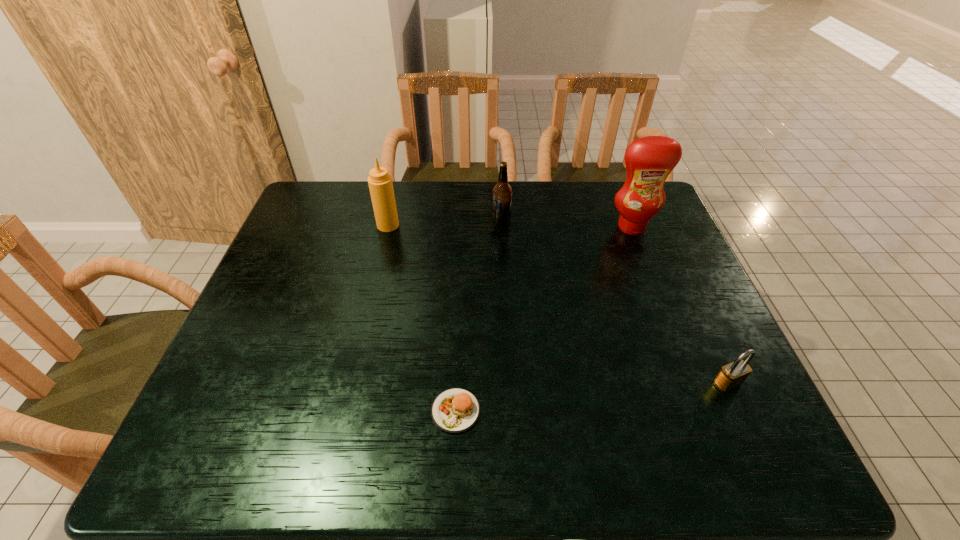
The height and width of the screenshot is (540, 960). What are the coordinates of `vacant space that satisfies the following two spatial constraints: 1. on the label side of the second shortest object; 2. on the left side of the right condiment` in the screenshot? It's located at (692, 383).

Identify the location of free spot that satisfies the following two spatial constraints: 1. on the label side of the padlock; 2. on the left side of the taller condiment. The image size is (960, 540). (692, 383).